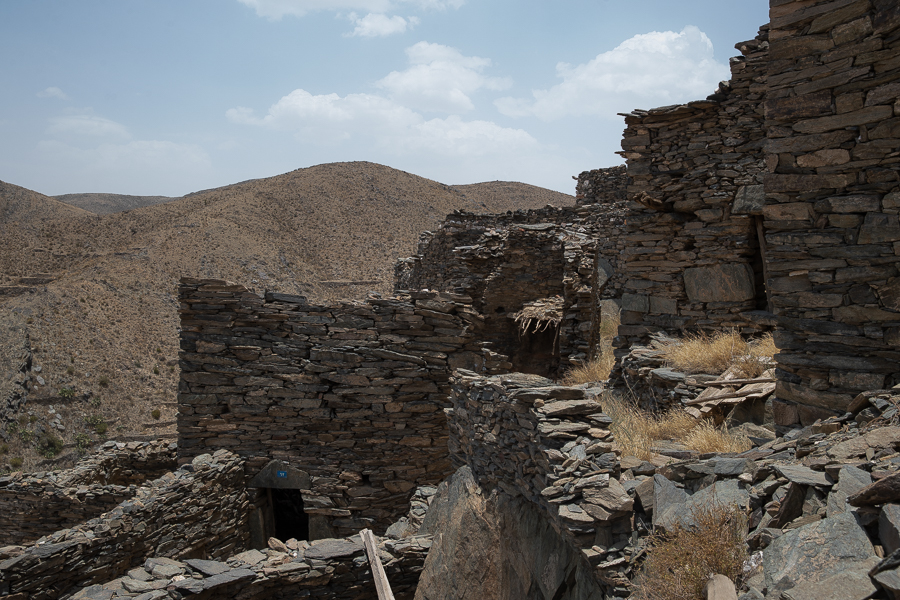
This screenshot has height=600, width=900. Identify the location of doorway. (286, 514).